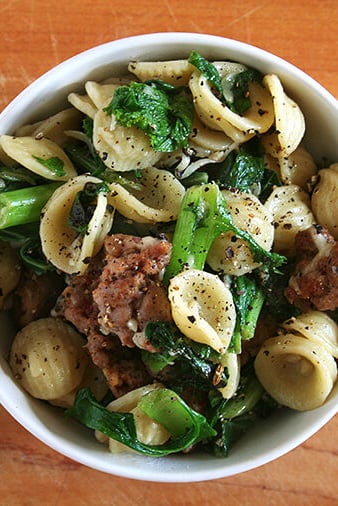
Where is `table, top of image and bottom`? table, top of image and bottom is located at coordinates point(199,16), point(225,491).